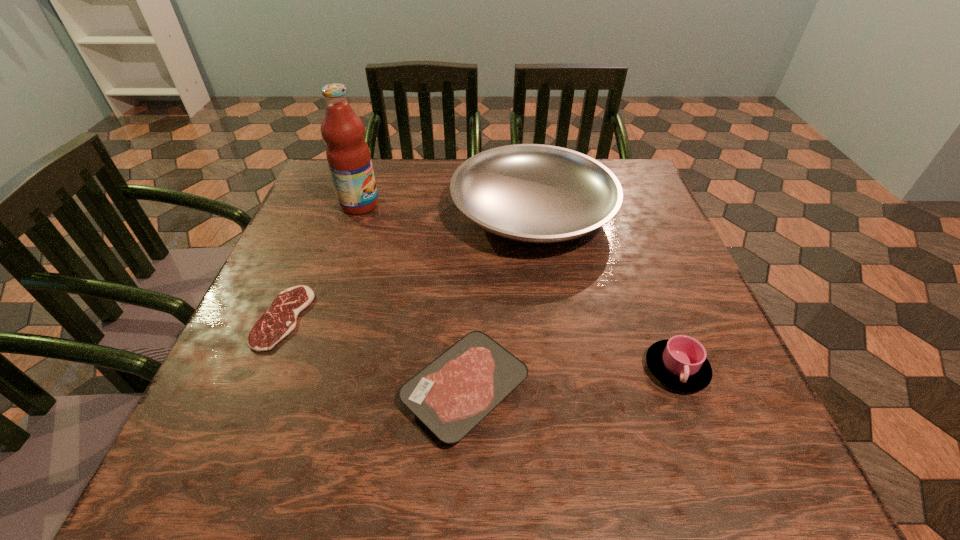
Find the location of `free space between the third shortest object and the second tallest object`. free space between the third shortest object and the second tallest object is located at coordinates tap(605, 291).

Locate an element on the screen. This screenshot has height=540, width=960. free space between the taller steak and the tallest object is located at coordinates (412, 298).

This screenshot has height=540, width=960. I want to click on free spot between the tallest object and the third shortest object, so click(518, 287).

Where is `object that can be found as the second closest to the shorter steak`? object that can be found as the second closest to the shorter steak is located at coordinates (348, 155).

Locate an element on the screen. object that stands as the closest to the bedpan is located at coordinates (348, 155).

Identify the location of vacant point that satisfies the following two spatial constraints: 1. on the front label of the bedpan; 2. on the right side of the tallest object. This screenshot has width=960, height=540. (357, 213).

The height and width of the screenshot is (540, 960). What are the coordinates of `vacant region that satisfies the following two spatial constraints: 1. on the front label of the tallest object; 2. on the left side of the bedpan` in the screenshot? It's located at (357, 213).